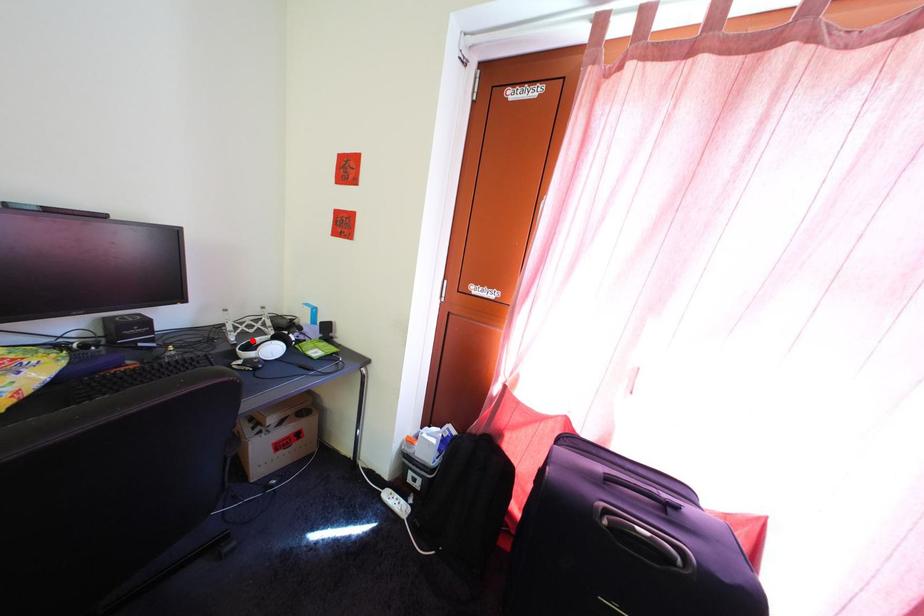
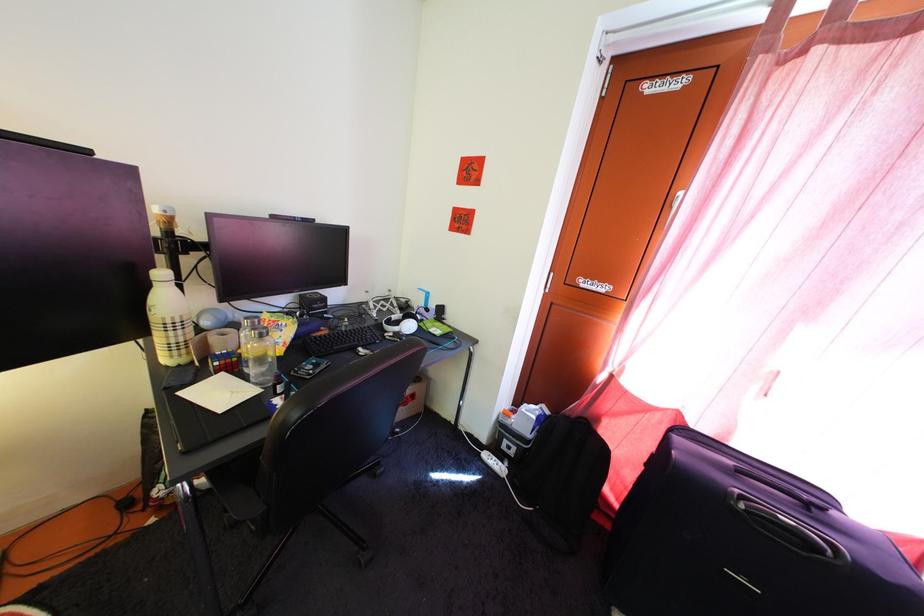
Find the pixel in the second image that matches the highlighted location in the first image.

(388, 318)